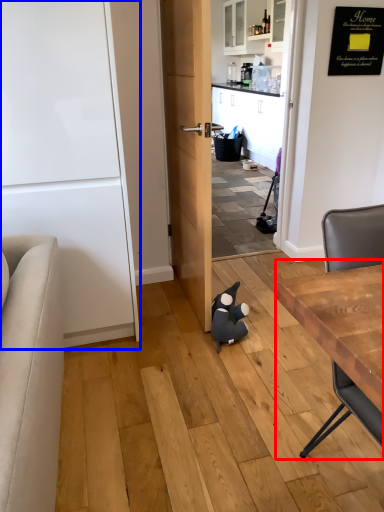
Question: Which of the following is the closest to the observer, table (highlighted by a red box) or door (highlighted by a blue box)?

Choices:
 (A) table
 (B) door

Answer: (A)